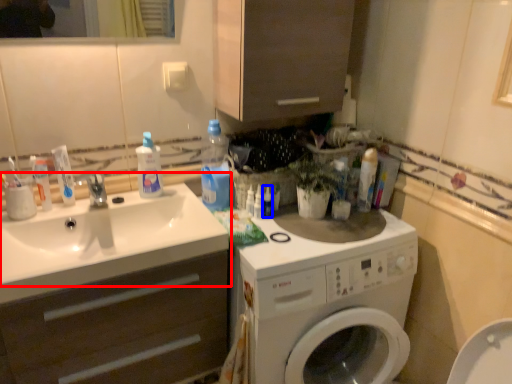
Question: Among these objects, which one is farthest to the camera, sink (highlighted by a red box) or toiletry (highlighted by a blue box)?

Choices:
 (A) sink
 (B) toiletry

Answer: (B)